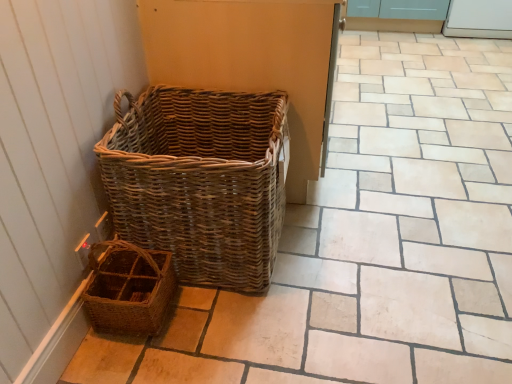
The width and height of the screenshot is (512, 384). I want to click on vacant space to the right of natural wicker picnic basket at left, which is the first picnic basket in top-to-bottom order, so click(342, 247).